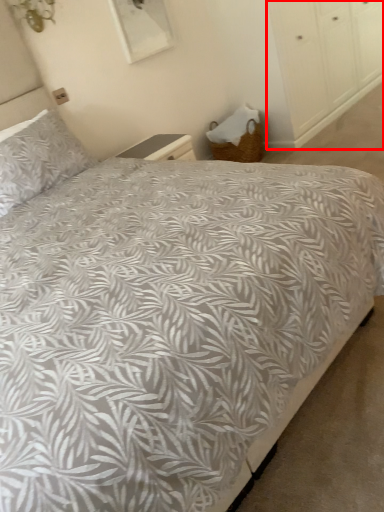
Question: Considering the relative positions of dresser (annotated by the red box) and pillow in the image provided, where is dresser (annotated by the red box) located with respect to the staircase?

Choices:
 (A) left
 (B) right

Answer: (B)